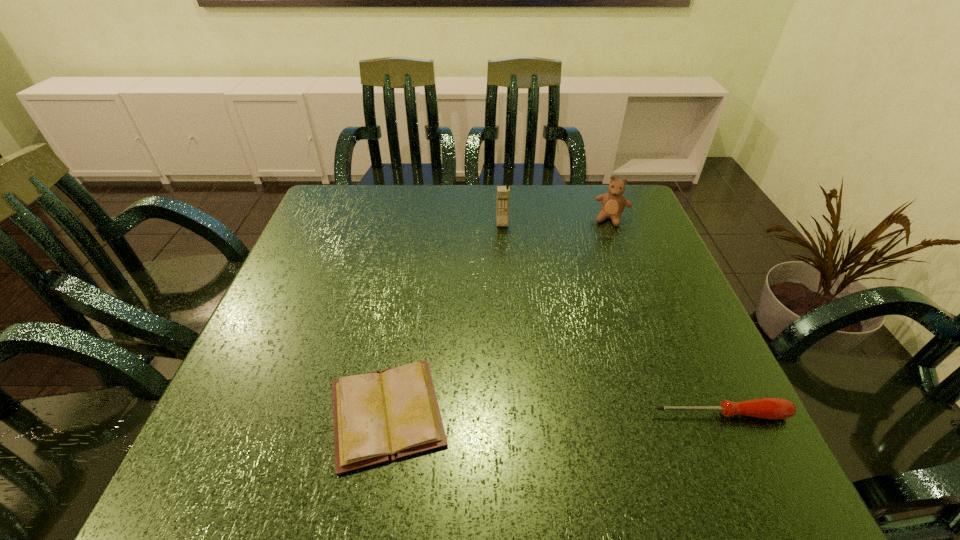
The height and width of the screenshot is (540, 960). I want to click on free spot on the desktop that is between the diary and the second shortest object and is positioned on the front of the tallest object, where the keypad is located, so click(522, 414).

The image size is (960, 540). I want to click on free space on the desktop that is between the shortest object and the screwdriver and is positioned on the front-facing side of the teddy bear, so [541, 414].